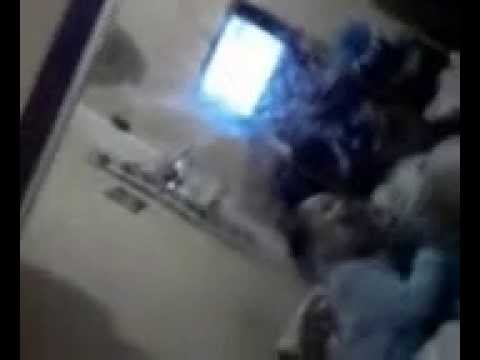
Image resolution: width=480 pixels, height=360 pixels. Find the location of `tv`. tv is located at coordinates (245, 68).